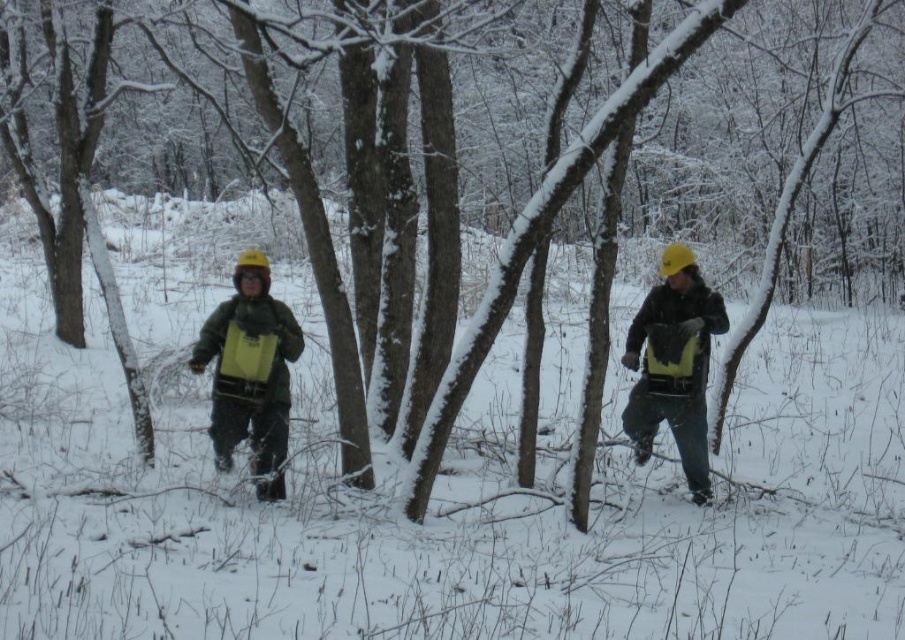
You are a hiker trying to locate your gear in the snowy forest. You see the matte green jacket at center and the yellow matte backpack at center. Which item is positioned more to the left?

The matte green jacket at center is positioned to the left of the yellow matte backpack at center, so the matte green jacket at center is more to the left.

You are standing in the snowy forest and want to move from point A to point B. The coordinates of point A are point A at (275, 486) and point B are point B at (688, 273). Which point is closer to you?

Point A at (275, 486) is closer to you than point B at (688, 273).

You are a hiker trying to locate your gear in the snowy forest. You see the matte green jacket at center and the yellow matte backpack at center. Which item is nearer to you?

The matte green jacket at center is closer to the viewer than the yellow matte backpack at center, so the jacket is nearer to you.